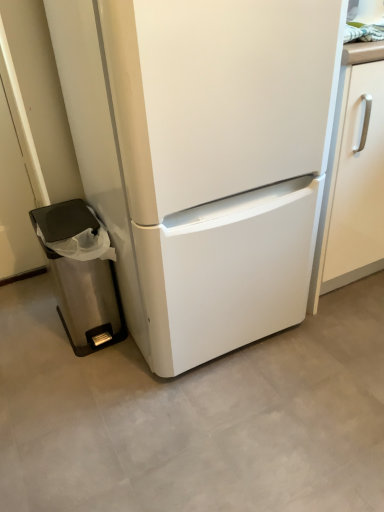
Question: Based on their sizes in the image, would you say stainless steel trash can at left is bigger or smaller than white matte refrigerator at center?

Choices:
 (A) big
 (B) small

Answer: (B)

Question: Is stainless steel trash can at left spatially inside white matte refrigerator at center, or outside of it?

Choices:
 (A) inside
 (B) outside

Answer: (B)

Question: Considering their positions, is stainless steel trash can at left located in front of or behind white matte refrigerator at center?

Choices:
 (A) front
 (B) behind

Answer: (B)

Question: In terms of width, does white matte refrigerator at center look wider or thinner when compared to stainless steel trash can at left?

Choices:
 (A) wide
 (B) thin

Answer: (A)

Question: Considering their positions, is white matte refrigerator at center located in front of or behind stainless steel trash can at left?

Choices:
 (A) behind
 (B) front

Answer: (B)

Question: Is white matte refrigerator at center taller or shorter than stainless steel trash can at left?

Choices:
 (A) tall
 (B) short

Answer: (A)

Question: Based on their sizes in the image, would you say white matte refrigerator at center is bigger or smaller than stainless steel trash can at left?

Choices:
 (A) big
 (B) small

Answer: (A)